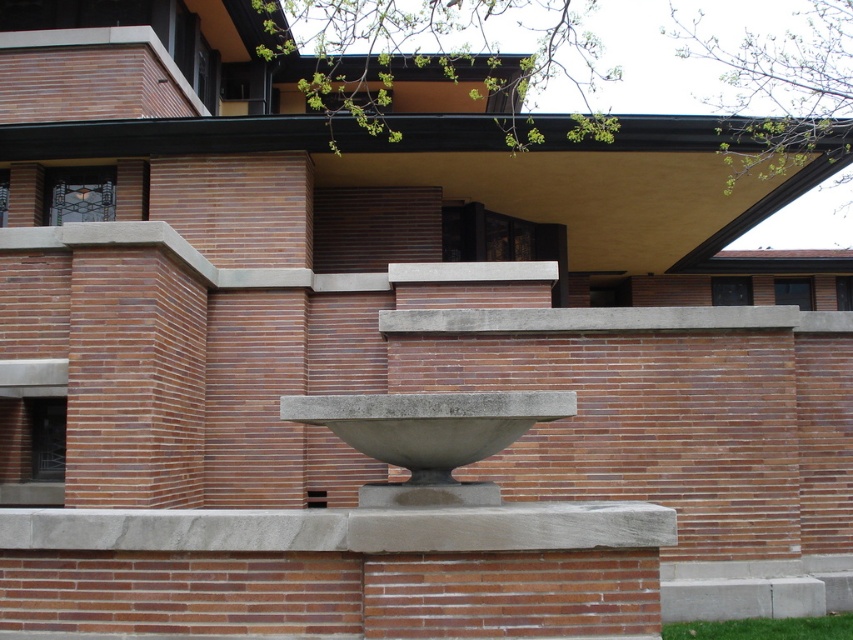
Question: From the image, what is the correct spatial relationship of gray concrete ledge at center in relation to gray concrete bowl at center?

Choices:
 (A) right
 (B) left

Answer: (B)

Question: Is gray concrete ledge at center closer to camera compared to gray concrete bowl at center?

Choices:
 (A) no
 (B) yes

Answer: (B)

Question: Among these points, which one is nearest to the camera?

Choices:
 (A) (595, 540)
 (B) (456, 406)

Answer: (A)

Question: Is gray concrete ledge at center below gray concrete bowl at center?

Choices:
 (A) yes
 (B) no

Answer: (A)